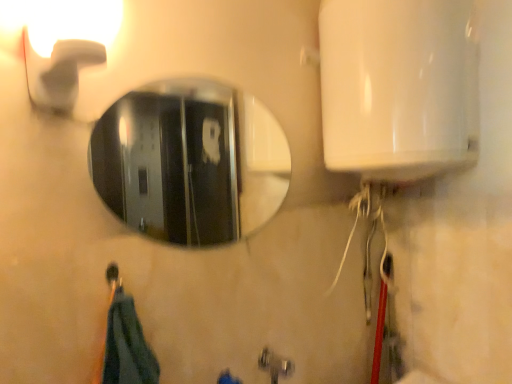
Describe the element at coordinates (66, 48) in the screenshot. This screenshot has width=512, height=384. I see `matte white faucet at upper left` at that location.

Measure the distance between point (51,38) and camera.

Point (51,38) is 71.30 centimeters from camera.

Locate an element on the screen. white glossy water heater at upper right is located at coordinates tap(399, 87).

What do you see at coordinates (275, 365) in the screenshot? The image size is (512, 384). I see `metallic silver faucet at lower center` at bounding box center [275, 365].

Where is `matte white faucet at upper left`? The width and height of the screenshot is (512, 384). matte white faucet at upper left is located at coordinates (66, 48).

Which is closer to the camera, (335, 82) or (267, 347)?

Point (335, 82).

Based on the photo, from the image's perspective, which object appears higher, white glossy water heater at upper right or metallic silver faucet at lower center?

white glossy water heater at upper right appears higher in the image.

Could you tell me if white glossy water heater at upper right is facing metallic silver faucet at lower center?

No, white glossy water heater at upper right is not facing towards metallic silver faucet at lower center.

Does matte white faucet at upper left have a larger size compared to metallic silver faucet at lower center?

Indeed, matte white faucet at upper left has a larger size compared to metallic silver faucet at lower center.

Does matte white faucet at upper left lie behind metallic silver faucet at lower center?

No, matte white faucet at upper left is closer to the camera.

From their relative heights in the image, would you say matte white faucet at upper left is taller or shorter than metallic silver faucet at lower center?

Considering their sizes, matte white faucet at upper left has more height than metallic silver faucet at lower center.

In the scene shown: Is matte white faucet at upper left oriented towards white glossy water heater at upper right?

No, matte white faucet at upper left is not oriented towards white glossy water heater at upper right.

From the image's perspective, which is below, matte white faucet at upper left or white glossy water heater at upper right?

matte white faucet at upper left, from the image's perspective.

In terms of size, does matte white faucet at upper left appear bigger or smaller than white glossy water heater at upper right?

Considering their sizes, matte white faucet at upper left takes up less space than white glossy water heater at upper right.

Considering the points (96, 123) and (74, 67), which point is behind, point (96, 123) or point (74, 67)?

The point (96, 123) is behind.

Does shiny metallic mirror at center come in front of matte white faucet at upper left?

No, it is not.

Can you confirm if shiny metallic mirror at center is positioned to the right of matte white faucet at upper left?

Correct, you'll find shiny metallic mirror at center to the right of matte white faucet at upper left.

Would you say matte white faucet at upper left is part of shiny metallic mirror at center's contents?

No.

From a real-world perspective, between metallic silver faucet at lower center and matte white faucet at upper left, who is vertically higher?

From a 3D spatial view, matte white faucet at upper left is above.

From the picture: Does metallic silver faucet at lower center lie in front of matte white faucet at upper left?

No, metallic silver faucet at lower center is further to the viewer.

Which of these two, metallic silver faucet at lower center or matte white faucet at upper left, is thinner?

matte white faucet at upper left.

How far apart are metallic silver faucet at lower center and white glossy water heater at upper right?

metallic silver faucet at lower center is 30.39 inches from white glossy water heater at upper right.

Does point (260, 363) lie in front of point (438, 55)?

No, (260, 363) is behind (438, 55).

From the image's perspective, which one is positioned higher, metallic silver faucet at lower center or white glossy water heater at upper right?

white glossy water heater at upper right is shown above in the image.

Can you see metallic silver faucet at lower center touching white glossy water heater at upper right?

metallic silver faucet at lower center is not next to white glossy water heater at upper right, and they're not touching.

From a real-world perspective, which object rests below the other?

From a 3D spatial view, metallic silver faucet at lower center is below.

Does point (220, 122) appear closer or farther from the camera than point (267, 358)?

Point (220, 122).

Which is more to the left, shiny metallic mirror at center or metallic silver faucet at lower center?

shiny metallic mirror at center.

I want to click on appliance located on the right of metallic silver faucet at lower center, so click(399, 87).

This screenshot has height=384, width=512. I want to click on plumbing fixture located below the matte white faucet at upper left (from the image's perspective), so click(275, 365).

Which object lies further to the anchor point white glossy water heater at upper right, metallic silver faucet at lower center or matte white faucet at upper left?

metallic silver faucet at lower center is positioned further to the anchor white glossy water heater at upper right.

When comparing their distances from matte white faucet at upper left, does metallic silver faucet at lower center or shiny metallic mirror at center seem further?

Based on the image, shiny metallic mirror at center appears to be further to matte white faucet at upper left.

Considering their positions, is white glossy water heater at upper right positioned closer to metallic silver faucet at lower center than shiny metallic mirror at center?

The object closer to metallic silver faucet at lower center is white glossy water heater at upper right.

Based on their spatial positions, is white glossy water heater at upper right or matte white faucet at upper left further from shiny metallic mirror at center?

matte white faucet at upper left lies further to shiny metallic mirror at center than the other object.

Based on their spatial positions, is shiny metallic mirror at center or white glossy water heater at upper right further from metallic silver faucet at lower center?

Based on the image, shiny metallic mirror at center appears to be further to metallic silver faucet at lower center.

Which object lies nearer to the anchor point matte white faucet at upper left, shiny metallic mirror at center or metallic silver faucet at lower center?

metallic silver faucet at lower center is positioned closer to the anchor matte white faucet at upper left.

In the scene shown: Considering their positions, is white glossy water heater at upper right positioned closer to matte white faucet at upper left than metallic silver faucet at lower center?

white glossy water heater at upper right is closer to matte white faucet at upper left.

Based on their spatial positions, is metallic silver faucet at lower center or white glossy water heater at upper right closer to shiny metallic mirror at center?

white glossy water heater at upper right lies closer to shiny metallic mirror at center than the other object.

Identify the location of mirror located between matte white faucet at upper left and white glossy water heater at upper right in the left-right direction. This screenshot has height=384, width=512. (188, 162).

Locate an element on the screen. Image resolution: width=512 pixels, height=384 pixels. light fixture between white glossy water heater at upper right and metallic silver faucet at lower center in the vertical direction is located at coordinates (66, 48).

Locate an element on the screen. Image resolution: width=512 pixels, height=384 pixels. mirror between white glossy water heater at upper right and metallic silver faucet at lower center from top to bottom is located at coordinates (188, 162).

Where is `mirror between matte white faucet at upper left and metallic silver faucet at lower center in the vertical direction`? mirror between matte white faucet at upper left and metallic silver faucet at lower center in the vertical direction is located at coordinates (188, 162).